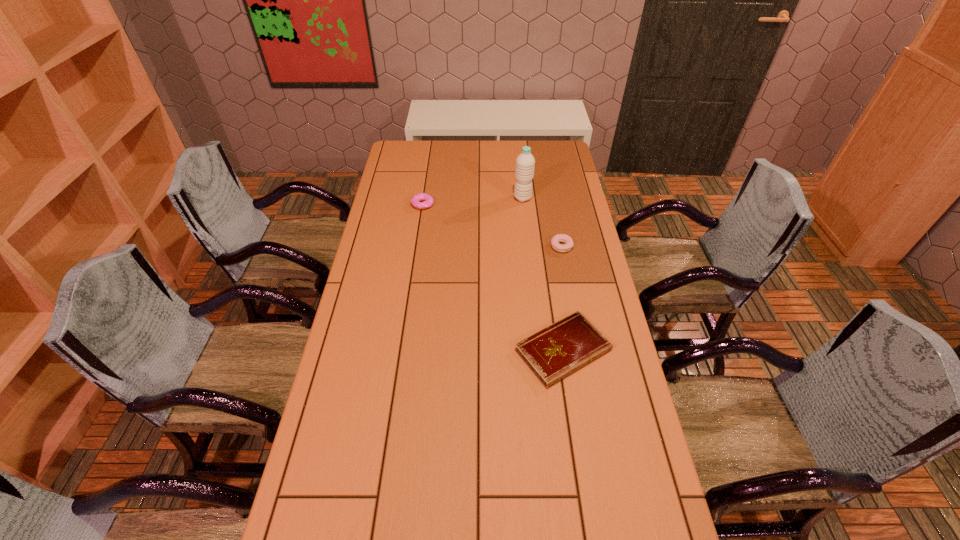
Find the location of a particular element. The height and width of the screenshot is (540, 960). vacant point located between the water bottle and the shortest object is located at coordinates (542, 274).

Locate an element on the screen. Image resolution: width=960 pixels, height=540 pixels. empty location between the left doughnut and the water bottle is located at coordinates (472, 201).

Find the location of a particular element. empty location between the water bottle and the left doughnut is located at coordinates (472, 201).

Locate an element on the screen. Image resolution: width=960 pixels, height=540 pixels. vacant area between the tallest object and the shortest object is located at coordinates (542, 274).

Locate an element on the screen. The image size is (960, 540). unoccupied position between the farther doughnut and the right doughnut is located at coordinates (492, 225).

This screenshot has height=540, width=960. I want to click on empty space between the tallest object and the right doughnut, so click(542, 222).

Identify the location of free space between the left doughnut and the nearest object. (493, 277).

You are a GUI agent. You are given a task and a screenshot of the screen. Output one action in this format:
    pyautogui.click(x=<x>, y=<y>)
    Task: Click on the vacant area that lies between the second nearest object and the farther doughnut
    This screenshot has height=540, width=960.
    Given the screenshot: What is the action you would take?
    pyautogui.click(x=492, y=225)

Find the location of `object that is the third closest one to the shortest object`. object that is the third closest one to the shortest object is located at coordinates (428, 200).

Identify which object is located as the nearest to the water bottle. Please provide its 2D coordinates. Your answer should be formatted as a tuple, i.e. [(x, y)], where the tuple contains the x and y coordinates of a point satisfying the conditions above.

[(555, 241)]